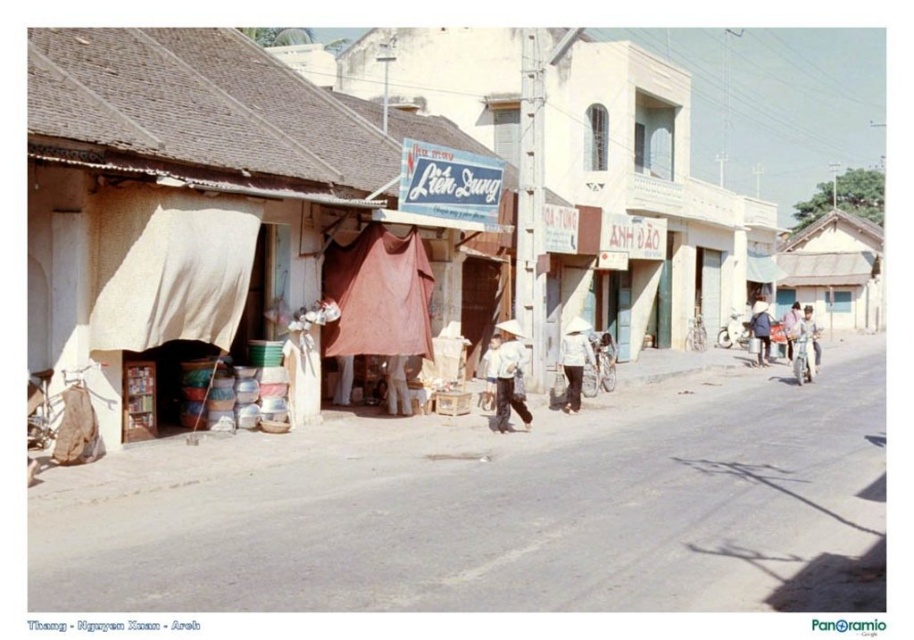
Can you confirm if white fabric hat at center is positioned to the right of pink fabric at center?

In fact, white fabric hat at center is to the left of pink fabric at center.

Which is more to the right, white fabric hat at center or pink fabric at center?

pink fabric at center is more to the right.

Is point (574, 372) positioned in front of point (792, 320)?

Yes, point (574, 372) is in front of point (792, 320).

Where is `white fabric hat at center`? Image resolution: width=914 pixels, height=640 pixels. white fabric hat at center is located at coordinates (574, 360).

Can you confirm if light blue denim jacket at right is wider than white matte hat at center?

Yes.

Based on the photo, can you confirm if light blue denim jacket at right is taller than white matte hat at center?

Yes.

Who is more forward, (810, 323) or (484, 355)?

Point (484, 355) is in front.

You are a GUI agent. You are given a task and a screenshot of the screen. Output one action in this format:
    pyautogui.click(x=<x>, y=<y>)
    Task: Click on the light blue denim jacket at right
    
    Given the screenshot: What is the action you would take?
    pyautogui.click(x=804, y=348)

Is white fabric tent at center thinner than pink fabric at center?

Indeed, white fabric tent at center has a lesser width compared to pink fabric at center.

What do you see at coordinates (197, 195) in the screenshot? I see `white fabric tent at center` at bounding box center [197, 195].

Describe the element at coordinates (197, 195) in the screenshot. I see `white fabric tent at center` at that location.

Where is `white fabric tent at center`? white fabric tent at center is located at coordinates (197, 195).